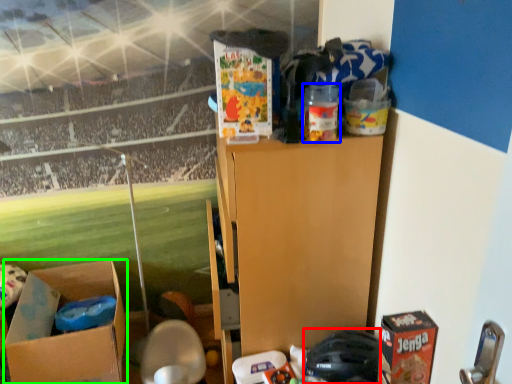
Question: Estimate the real-world distances between objects in this image. Which object is farther from toy (highlighted by a red box), toy (highlighted by a blue box) or box (highlighted by a green box)?

Choices:
 (A) toy
 (B) box

Answer: (B)